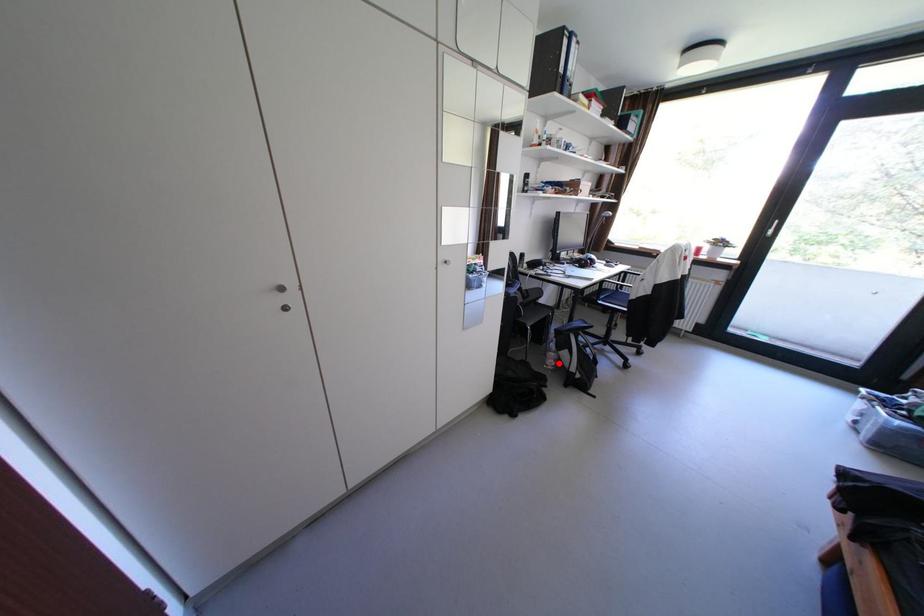
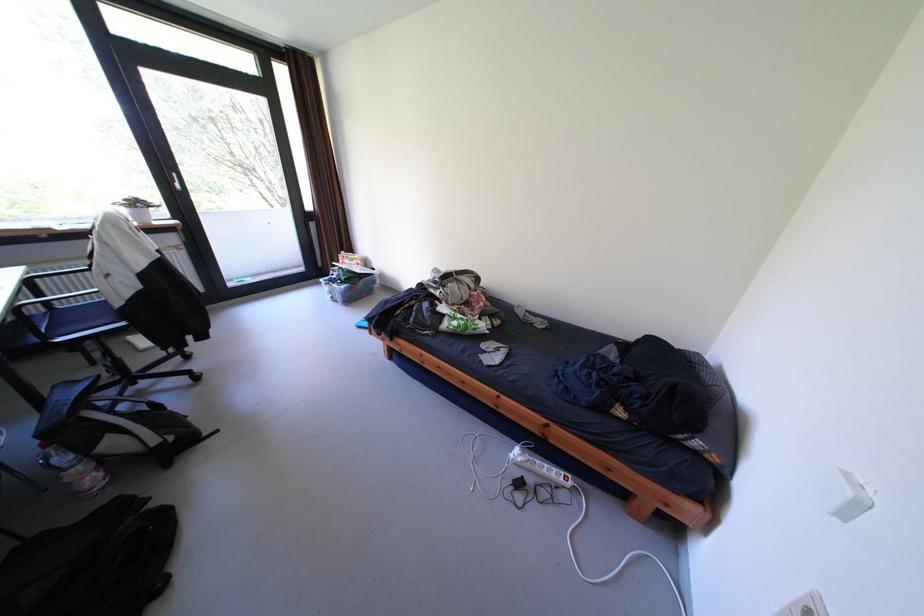
Find the pixel in the second image that matches the highlighted location in the first image.

(99, 485)